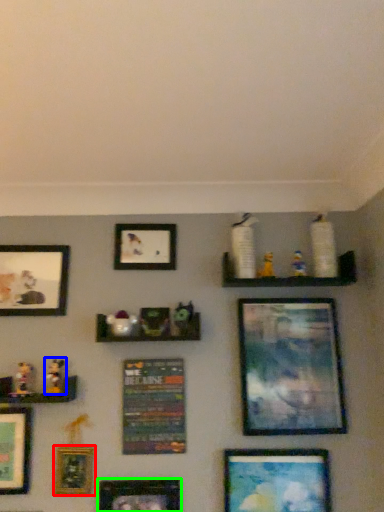
Question: Which is nearer to the picture frame (highlighted by a red box)? toy (highlighted by a blue box) or picture frame (highlighted by a green box).

Choices:
 (A) toy
 (B) picture frame

Answer: (B)